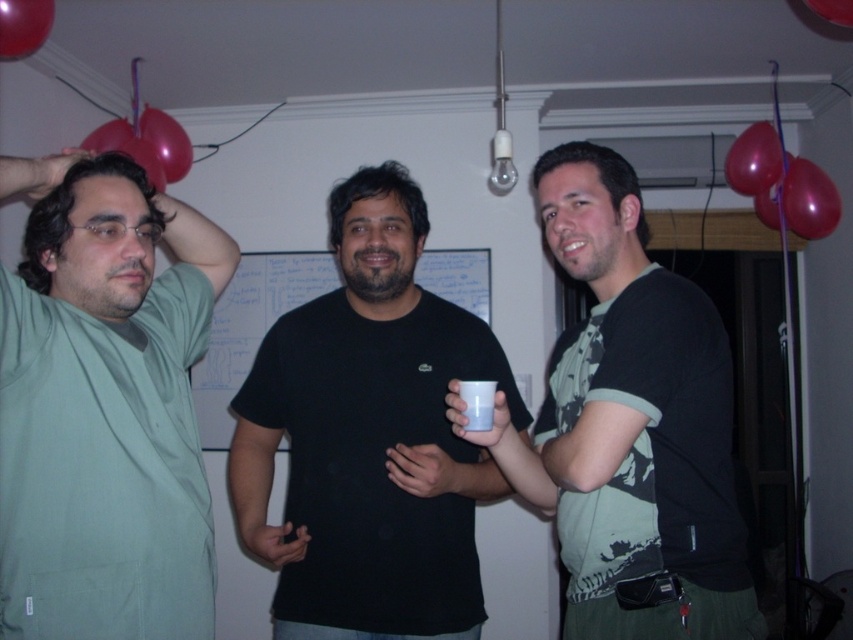
Does green cotton t-shirt at center have a smaller size compared to white matte cup at center?

No.

Between green cotton t-shirt at center and white matte cup at center, which one is positioned lower?

white matte cup at center is lower down.

Who is more distant from viewer, (x=724, y=488) or (x=474, y=385)?

Point (x=724, y=488)

At what (x,y) coordinates should I click in order to perform the action: click on green cotton t-shirt at center. Please return your answer as a coordinate pair (x, y). This screenshot has height=640, width=853. Looking at the image, I should click on (630, 420).

Between rubber balloon at upper left and white matte cup at center, which one has more height?

With more height is rubber balloon at upper left.

Can you confirm if rubber balloon at upper left is positioned above white matte cup at center?

Indeed, rubber balloon at upper left is positioned over white matte cup at center.

I want to click on rubber balloon at upper left, so click(x=165, y=141).

Which is below, green cotton t-shirt at center or red matte balloon at upper left?

green cotton t-shirt at center

Is green cotton t-shirt at center positioned at the back of red matte balloon at upper left?

No, green cotton t-shirt at center is closer to the viewer.

Who is more distant from viewer, [677,476] or [4,13]?

Point [4,13]

In order to click on green cotton t-shirt at center in this screenshot , I will do `click(630, 420)`.